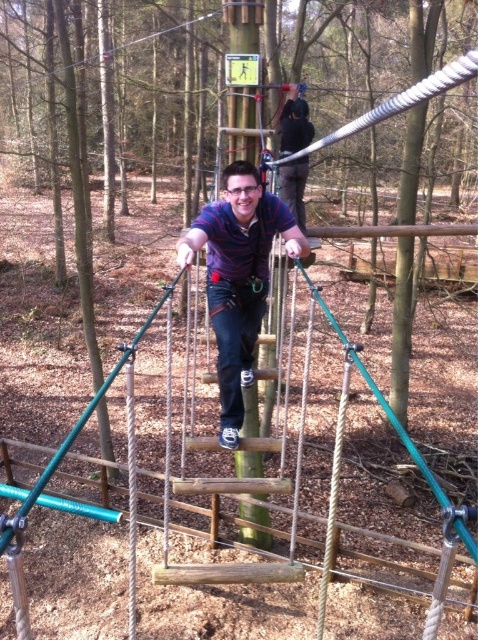
Who is taller, striped cotton shirt at center or matte blue shirt at center?

With more height is matte blue shirt at center.

Does striped cotton shirt at center have a greater width compared to matte blue shirt at center?

Yes, striped cotton shirt at center is wider than matte blue shirt at center.

The image size is (478, 640). What are the coordinates of `striped cotton shirt at center` in the screenshot? It's located at (239, 276).